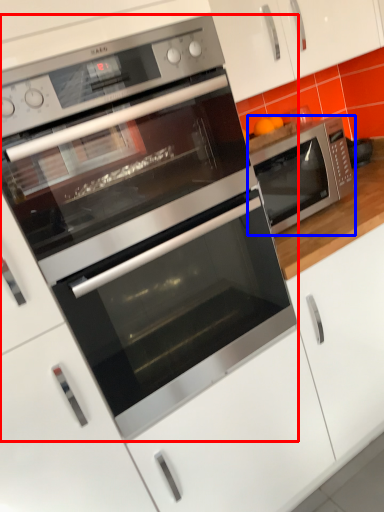
Question: Which object is further to the camera taking this photo, microwave oven (highlighted by a red box) or microwave oven (highlighted by a blue box)?

Choices:
 (A) microwave oven
 (B) microwave oven

Answer: (B)